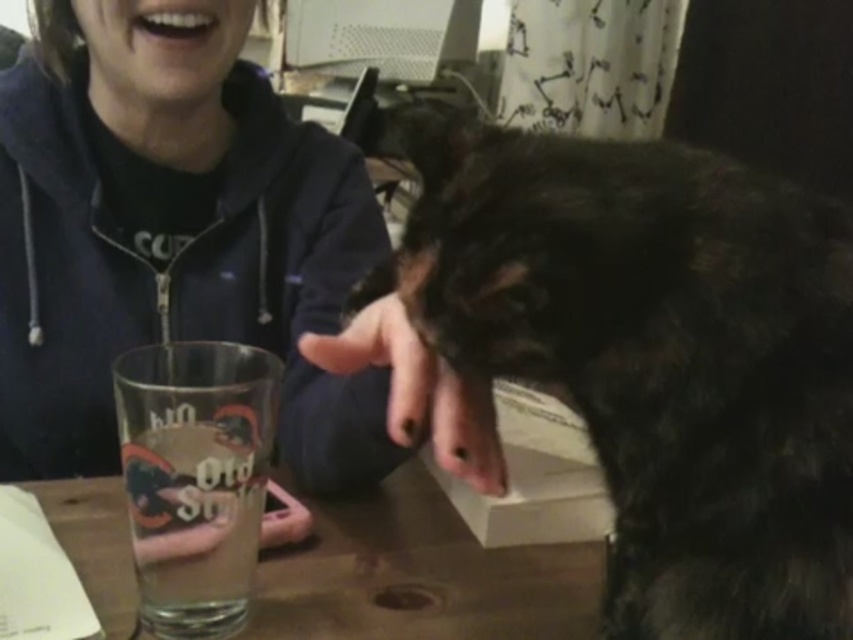
Between point (107, 120) and point (189, 28), which one is positioned behind?

The point (107, 120) is behind.

You are a GUI agent. You are given a task and a screenshot of the screen. Output one action in this format:
    pyautogui.click(x=<x>, y=<y>)
    Task: Click on the matte black hoodie at center
    The width and height of the screenshot is (853, 640).
    Given the screenshot: What is the action you would take?
    pyautogui.click(x=286, y=256)

Which is more to the left, matte black hoodie at center or clear glass at center?

Positioned to the left is matte black hoodie at center.

Does matte black hoodie at center appear on the left side of clear glass at center?

Correct, you'll find matte black hoodie at center to the left of clear glass at center.

Does point (430, 410) lie in front of point (198, 545)?

No, (430, 410) is behind (198, 545).

This screenshot has height=640, width=853. Identify the location of matte black hoodie at center. (286, 256).

Can you confirm if dark fur dog at center is thinner than matte black hoodie at center?

Yes.

Can you confirm if dark fur dog at center is positioned below matte black hoodie at center?

Yes, dark fur dog at center is below matte black hoodie at center.

The height and width of the screenshot is (640, 853). What do you see at coordinates (656, 353) in the screenshot? I see `dark fur dog at center` at bounding box center [656, 353].

You are a GUI agent. You are given a task and a screenshot of the screen. Output one action in this format:
    pyautogui.click(x=<x>, y=<y>)
    Task: Click on the dark fur dog at center
    This screenshot has height=640, width=853.
    Given the screenshot: What is the action you would take?
    [656, 353]